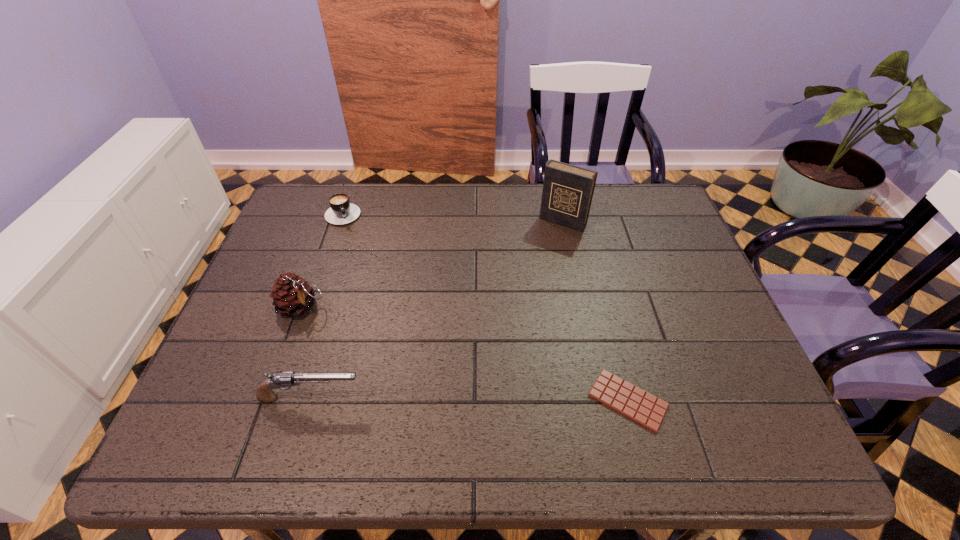
You are a GUI agent. You are given a task and a screenshot of the screen. Output one action in this format:
    pyautogui.click(x=<x>, y=<y>)
    Task: Click on the candy bar present at the near edge
    
    Given the screenshot: What is the action you would take?
    pyautogui.click(x=634, y=403)

Identify the location of gun present at the left edge. (264, 392).

Where is `pinecone present at the left edge`? This screenshot has height=540, width=960. pinecone present at the left edge is located at coordinates (292, 296).

This screenshot has width=960, height=540. Identify the location of cappuccino at the left edge. (341, 211).

The width and height of the screenshot is (960, 540). Find the location of `object that is at the far left corner`. object that is at the far left corner is located at coordinates (341, 211).

Find the location of a particular element. The image size is (960, 540). object situated at the near left corner is located at coordinates (264, 392).

Locate an element on the screen. The height and width of the screenshot is (540, 960). vacant area at the far edge of the desktop is located at coordinates (466, 229).

What are the coordinates of `vacant space at the left edge of the desktop` in the screenshot? It's located at (298, 332).

At what (x,y) coordinates should I click in order to perform the action: click on free spot at the right edge of the desktop. Please return your answer as a coordinate pair (x, y). Looking at the image, I should click on (645, 256).

In the image, there is a desktop. Find the location of `free region at the far left corner`. free region at the far left corner is located at coordinates (313, 193).